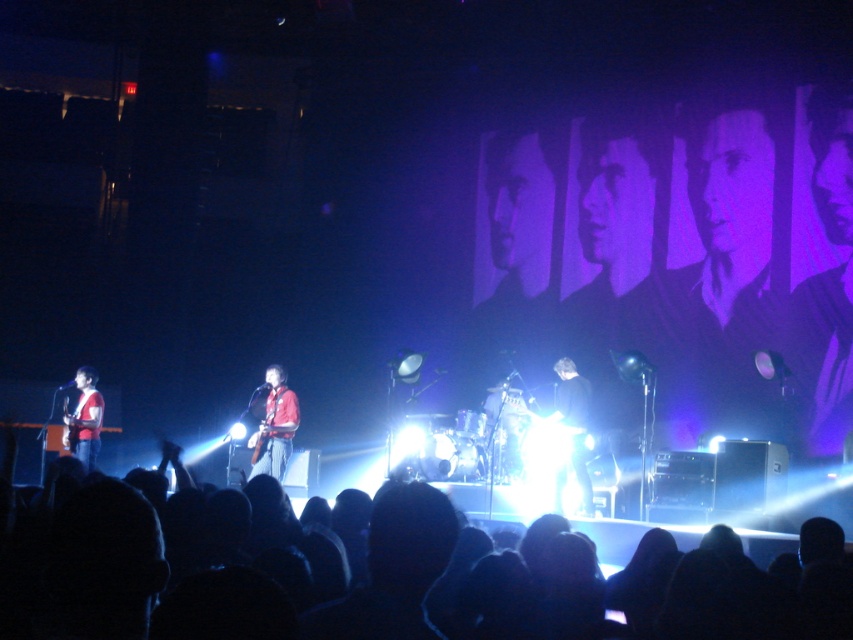
Is red fabric guitar at center positioned before matte red shirt at left?

Yes, it is in front of matte red shirt at left.

Is point (270, 403) behind point (90, 410)?

That is False.

Is point (252, 436) in front of point (88, 429)?

Yes, it is.

This screenshot has height=640, width=853. Find the location of `red fabric guitar at center`. red fabric guitar at center is located at coordinates (274, 426).

Is black fabric crowd at lower center wider than matte red shirt at left?

Indeed, black fabric crowd at lower center has a greater width compared to matte red shirt at left.

Is point (479, 621) positioned after point (91, 384)?

No, it is not.

This screenshot has width=853, height=640. I want to click on black fabric crowd at lower center, so click(x=393, y=577).

Consider the image. Can you confirm if black fabric crowd at lower center is positioned below red fabric guitar at center?

Yes, black fabric crowd at lower center is below red fabric guitar at center.

Can you confirm if black fabric crowd at lower center is bigger than red fabric guitar at center?

Yes.

Is point (722, 632) farther from viewer compared to point (270, 408)?

No, it is not.

Identify the location of black fabric crowd at lower center. This screenshot has height=640, width=853. (393, 577).